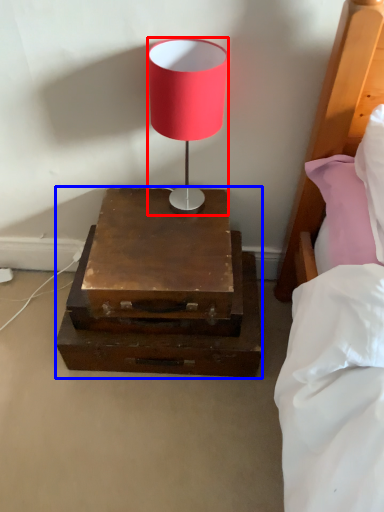
Question: Among these objects, which one is farthest to the camera, lamp (highlighted by a red box) or nightstand (highlighted by a blue box)?

Choices:
 (A) lamp
 (B) nightstand

Answer: (B)